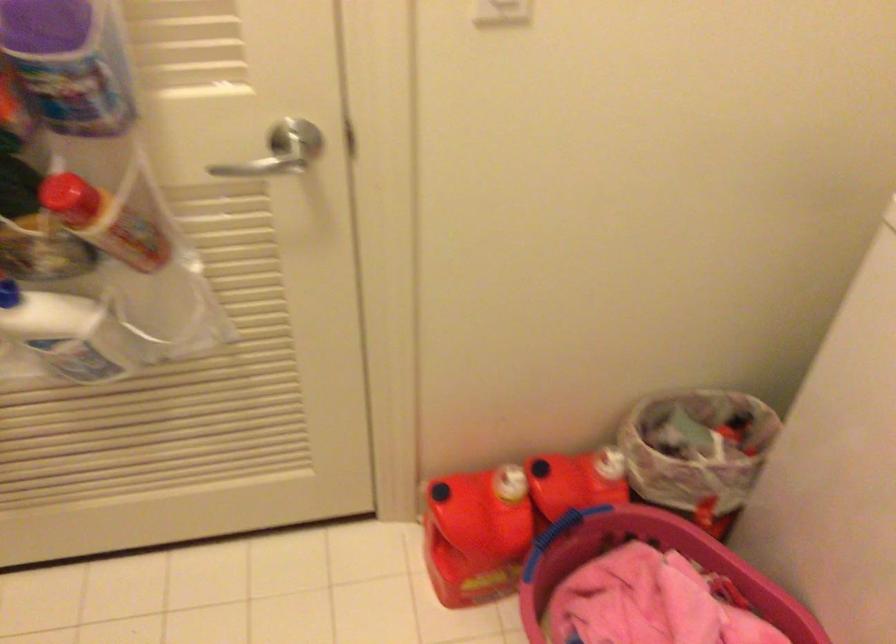
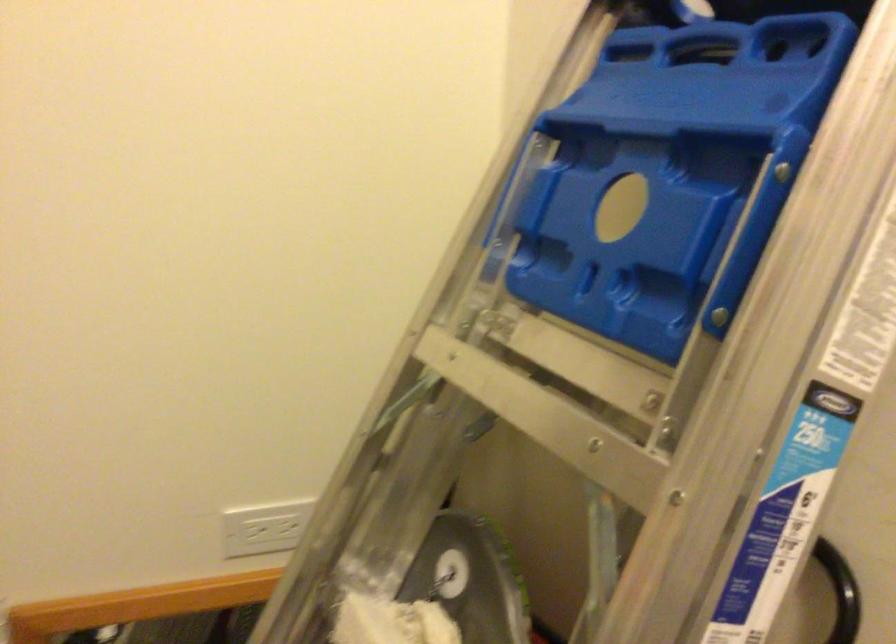
Question: How did the camera likely rotate?

Choices:
 (A) Left
 (B) Right
 (C) Up
 (D) Down

Answer: (A)